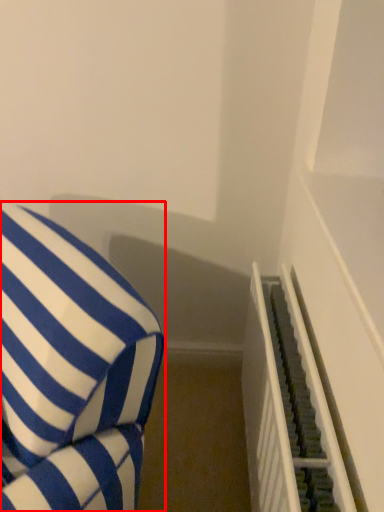
Question: From the image, what is the correct spatial relationship of furniture (annotated by the red box) in relation to stairwell?

Choices:
 (A) right
 (B) left

Answer: (B)